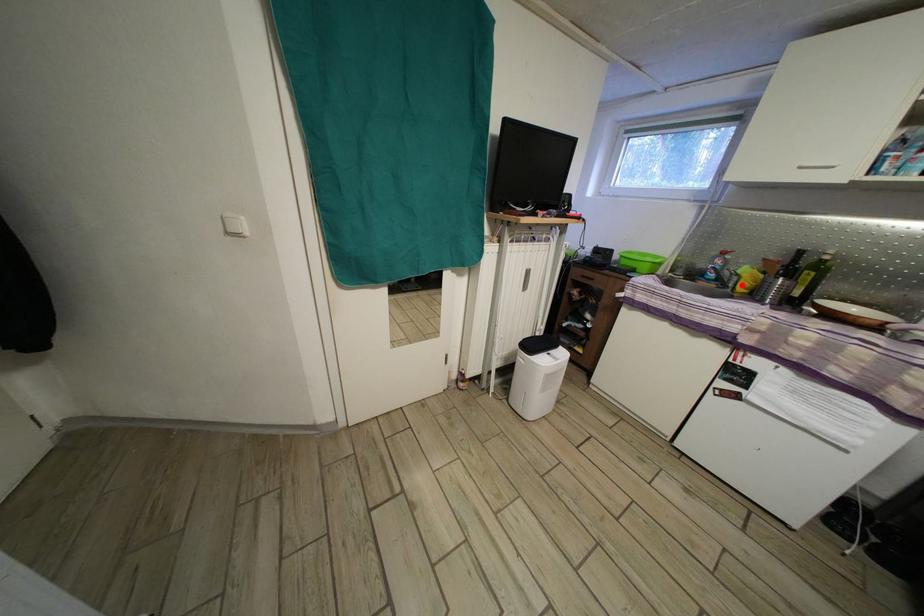
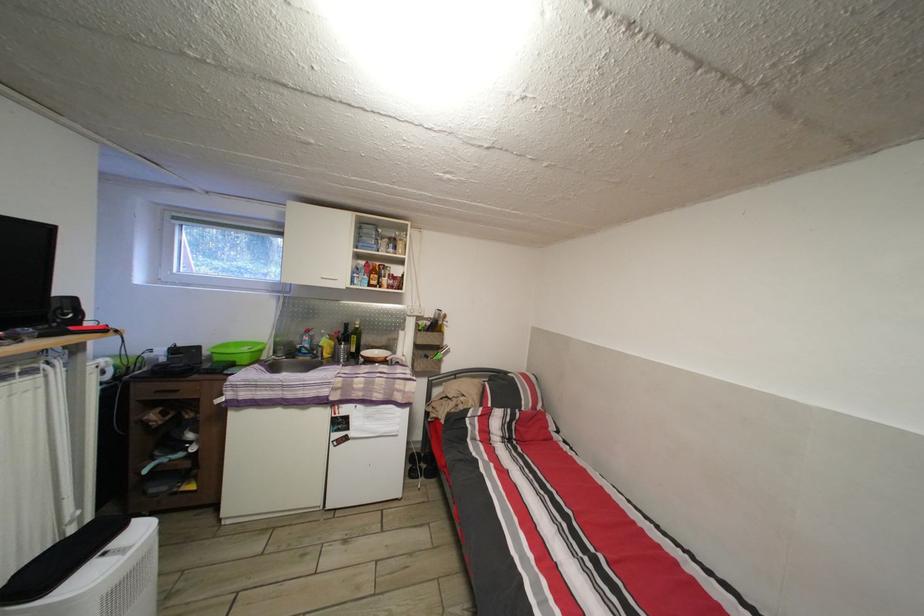
In the second image, find the point that corresponds to the highlighted location in the first image.

(327, 355)